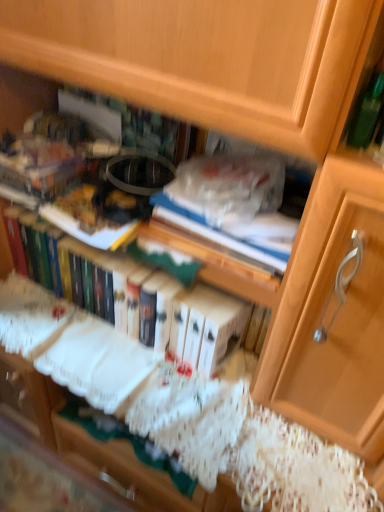
Find the location of a particular element. The image size is (384, 512). vacant point above blue hardcover book at center (from a real-world perspective) is located at coordinates (228, 205).